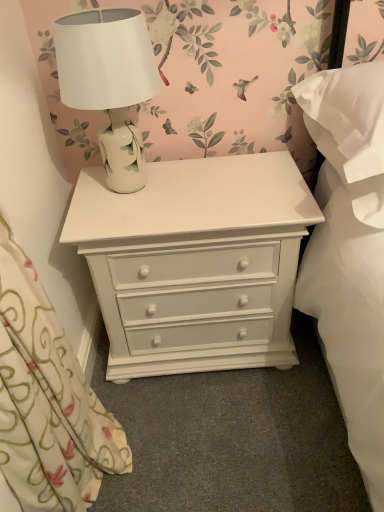
The image size is (384, 512). I want to click on free region under white ceramic lamp at upper center (from a real-world perspective), so click(x=141, y=188).